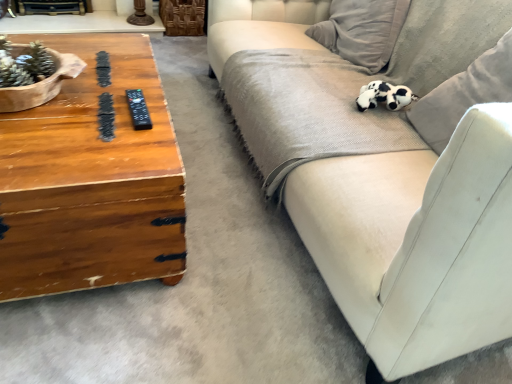
Question: Is velvet beige couch at right positioned with its back to black and white plush toy at upper right?

Choices:
 (A) no
 (B) yes

Answer: (B)

Question: Considering the relative sizes of velvet beige couch at right and black and white plush toy at upper right in the image provided, is velvet beige couch at right smaller than black and white plush toy at upper right?

Choices:
 (A) yes
 (B) no

Answer: (B)

Question: Is velvet beige couch at right to the left of black and white plush toy at upper right from the viewer's perspective?

Choices:
 (A) no
 (B) yes

Answer: (A)

Question: Is velvet beige couch at right with black and white plush toy at upper right?

Choices:
 (A) no
 (B) yes

Answer: (A)

Question: Is the position of velvet beige couch at right more distant than that of black and white plush toy at upper right?

Choices:
 (A) no
 (B) yes

Answer: (A)

Question: Is velvet beige couch at right not near black and white plush toy at upper right?

Choices:
 (A) no
 (B) yes

Answer: (A)

Question: From the image's perspective, does woodenmaterial/texturecoffee table at left appear lower than velvet beige couch at right?

Choices:
 (A) yes
 (B) no

Answer: (A)

Question: Is woodenmaterial/texturecoffee table at left to the right of velvet beige couch at right from the viewer's perspective?

Choices:
 (A) no
 (B) yes

Answer: (A)

Question: Is woodenmaterial/texturecoffee table at left closer to the viewer compared to velvet beige couch at right?

Choices:
 (A) no
 (B) yes

Answer: (B)

Question: Is woodenmaterial/texturecoffee table at left outside velvet beige couch at right?

Choices:
 (A) yes
 (B) no

Answer: (A)

Question: Is woodenmaterial/texturecoffee table at left shorter than velvet beige couch at right?

Choices:
 (A) yes
 (B) no

Answer: (A)

Question: From a real-world perspective, is woodenmaterial/texturecoffee table at left located higher than velvet beige couch at right?

Choices:
 (A) no
 (B) yes

Answer: (A)

Question: From a real-world perspective, is black plastic remote at left physically above velvet beige couch at right?

Choices:
 (A) no
 (B) yes

Answer: (B)